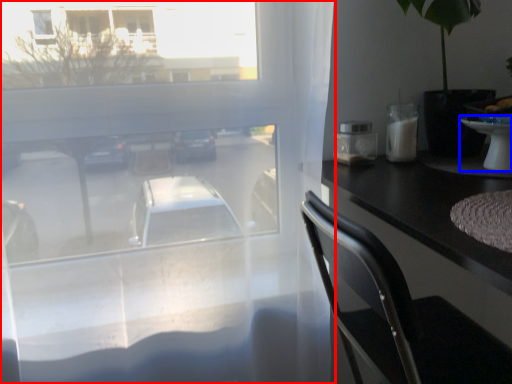
Question: Which object is closer to the camera taking this photo, window (highlighted by a red box) or table (highlighted by a blue box)?

Choices:
 (A) window
 (B) table

Answer: (A)